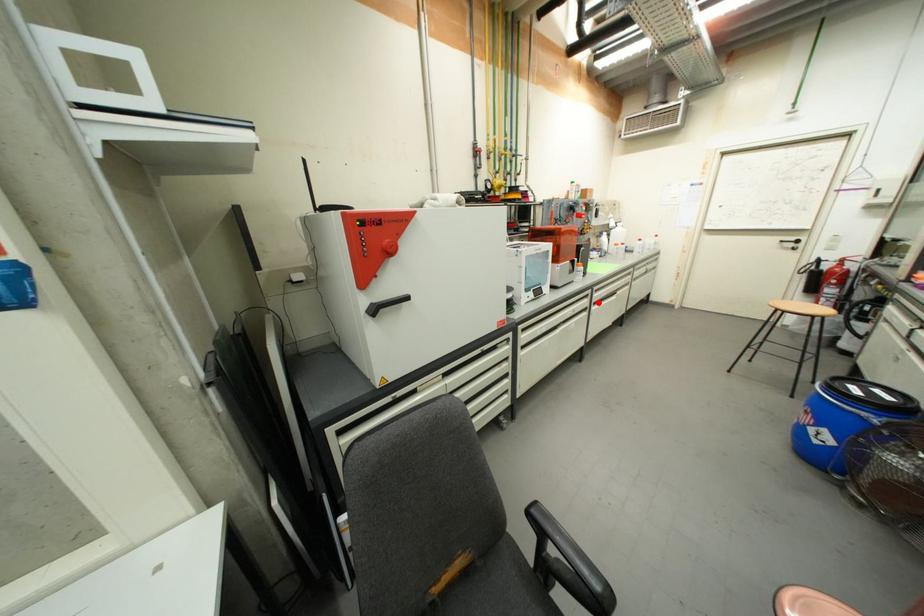
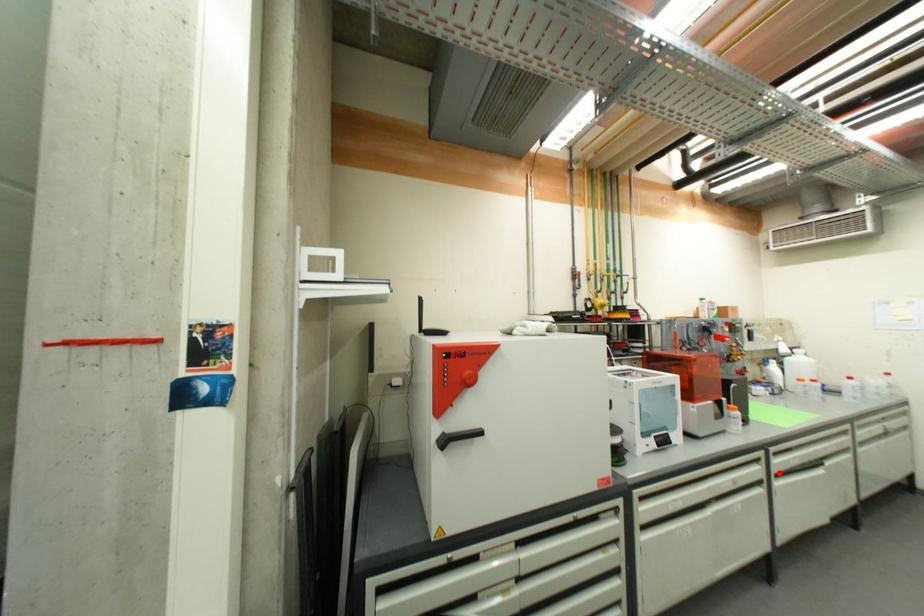
Looking at this image, I am providing you with two images of the same scene from different viewpoints. A red point is marked on the first image and another point is marked on the second image. Is the marked point in image1 the same physical position as the marked point in image2?

Yes